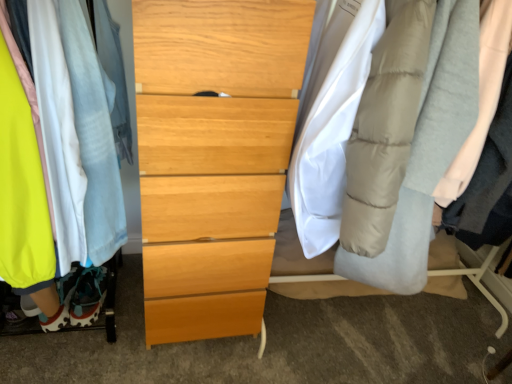
Measure the distance between point (240, 69) and camera.

The depth of point (240, 69) is 1.01 meters.

What is the approximate width of matte fabric clothes at left?

It is 26.02 inches.

Image resolution: width=512 pixels, height=384 pixels. What are the coordinates of `matte blue sneaker at lower left` in the screenshot? It's located at [88, 296].

Would you say light blue cotton robe at left, which is counted as the 1th robe, starting from the left, is outside matte blue sneaker at lower left?

Yes, light blue cotton robe at left, which is counted as the 1th robe, starting from the left, is outside of matte blue sneaker at lower left.

From a real-world perspective, is light blue cotton robe at left, the 2th robe positioned from the right, physically below matte blue sneaker at lower left?

No, from a real-world perspective, light blue cotton robe at left, the 2th robe positioned from the right, is not below matte blue sneaker at lower left.

Can you see light blue cotton robe at left, the 2th robe positioned from the right, touching matte blue sneaker at lower left?

light blue cotton robe at left, the 2th robe positioned from the right, is not next to matte blue sneaker at lower left, and they're not touching.

Image resolution: width=512 pixels, height=384 pixels. What are the coordinates of `the 1st robe positioned above the matte blue sneaker at lower left (from a real-world perspective)` in the screenshot? It's located at tap(92, 139).

You are a GUI agent. You are given a task and a screenshot of the screen. Output one action in this format:
    pyautogui.click(x=<x>, y=<y>)
    Task: Click on the chest of drawers on the right of matte fabric clothes at left
    The width and height of the screenshot is (512, 384).
    Given the screenshot: What is the action you would take?
    pyautogui.click(x=213, y=157)

Can you confirm if matte fabric clothes at left is shorter than light wood chest of drawers at center?

Yes, matte fabric clothes at left is shorter than light wood chest of drawers at center.

From the image's perspective, which one is positioned lower, matte fabric clothes at left or light wood chest of drawers at center?

light wood chest of drawers at center, from the image's perspective.

From the picture: Which point is more forward, (96, 256) or (202, 40)?

Positioned in front is point (202, 40).

Can you tell me how much matte fabric clothes at left and matte blue sneaker at lower left differ in facing direction?

0.616 degrees.

Considering the points (61, 214) and (106, 290), which point is in front, point (61, 214) or point (106, 290)?

The point (61, 214) is more forward.

Is matte fabric clothes at left taller than matte blue sneaker at lower left?

Yes, matte fabric clothes at left is taller than matte blue sneaker at lower left.

Is matte fabric clothes at left positioned with its back to matte blue sneaker at lower left?

No, matte fabric clothes at left is not facing the opposite direction of matte blue sneaker at lower left.

In the image, is light wood chest of drawers at center on the left side or the right side of light gray quilted robe at right, which appears as the 2th robe when viewed from the left?

From the image, it's evident that light wood chest of drawers at center is to the left of light gray quilted robe at right, which appears as the 2th robe when viewed from the left.

Find the location of a particular element. Image resolution: width=512 pixels, height=384 pixels. chest of drawers behind the light gray quilted robe at right, which appears as the 2th robe when viewed from the left is located at coordinates (213, 157).

Looking at this image, how many degrees apart are the facing directions of light wood chest of drawers at center and light gray quilted robe at right, which appears as the 2th robe when viewed from the left?

The facing directions of light wood chest of drawers at center and light gray quilted robe at right, which appears as the 2th robe when viewed from the left, are 0.0574 degrees apart.

Considering the sizes of objects light wood chest of drawers at center and light gray quilted robe at right, which appears as the 2th robe when viewed from the left, in the image provided, who is thinner, light wood chest of drawers at center or light gray quilted robe at right, which appears as the 2th robe when viewed from the left,?

Thinner between the two is light gray quilted robe at right, which appears as the 2th robe when viewed from the left.

Which object is positioned more to the right, matte blue sneaker at lower left or light gray quilted robe at right, the first robe in the right-to-left sequence?

light gray quilted robe at right, the first robe in the right-to-left sequence.

Is matte blue sneaker at lower left further to camera compared to light gray quilted robe at right, which appears as the 2th robe when viewed from the left?

Yes.

How much distance is there between matte blue sneaker at lower left and light gray quilted robe at right, which appears as the 2th robe when viewed from the left?

matte blue sneaker at lower left and light gray quilted robe at right, which appears as the 2th robe when viewed from the left, are 1.25 meters apart.

From their relative heights in the image, would you say matte blue sneaker at lower left is taller or shorter than light gray quilted robe at right, which appears as the 2th robe when viewed from the left?

Clearly, matte blue sneaker at lower left is shorter compared to light gray quilted robe at right, which appears as the 2th robe when viewed from the left.

Is matte blue sneaker at lower left to the left of light blue cotton robe at left, the 2th robe positioned from the right, from the viewer's perspective?

Correct, you'll find matte blue sneaker at lower left to the left of light blue cotton robe at left, the 2th robe positioned from the right.

In the scene shown: Would you say matte blue sneaker at lower left contains light blue cotton robe at left, the 2th robe positioned from the right?

That's incorrect, light blue cotton robe at left, the 2th robe positioned from the right, is not inside matte blue sneaker at lower left.

Where is `shoe that is under the light blue cotton robe at left, the 2th robe positioned from the right (from a real-world perspective)`? This screenshot has height=384, width=512. shoe that is under the light blue cotton robe at left, the 2th robe positioned from the right (from a real-world perspective) is located at coordinates (88, 296).

Is matte blue sneaker at lower left further to camera compared to light blue cotton robe at left, the 2th robe positioned from the right?

Yes, matte blue sneaker at lower left is further from the camera.

Is matte blue sneaker at lower left next to matte fabric clothes at left?

matte blue sneaker at lower left and matte fabric clothes at left are not in contact.

Can you confirm if matte blue sneaker at lower left is smaller than matte fabric clothes at left?

Correct, matte blue sneaker at lower left occupies less space than matte fabric clothes at left.

How distant is matte blue sneaker at lower left from matte fabric clothes at left?

matte blue sneaker at lower left is 54.61 centimeters away from matte fabric clothes at left.

From a real-world perspective, is matte blue sneaker at lower left under matte fabric clothes at left?

Yes.

I want to click on shoe below the light blue cotton robe at left, the 2th robe positioned from the right (from a real-world perspective), so click(x=88, y=296).

This screenshot has width=512, height=384. In order to click on closet above the light wood chest of drawers at center (from the image's perspective) in this screenshot , I will do `click(77, 134)`.

When comparing their distances from matte fabric clothes at left, does light gray quilted robe at right, which appears as the 2th robe when viewed from the left, or light blue cotton robe at left, the 2th robe positioned from the right, seem closer?

light blue cotton robe at left, the 2th robe positioned from the right, is closer to matte fabric clothes at left.

Estimate the real-world distances between objects in this image. Which object is closer to light blue cotton robe at left, which is counted as the 1th robe, starting from the left, matte blue sneaker at lower left or light wood chest of drawers at center?

light wood chest of drawers at center is closer to light blue cotton robe at left, which is counted as the 1th robe, starting from the left.

Consider the image. Based on their spatial positions, is light blue cotton robe at left, the 2th robe positioned from the right, or light wood chest of drawers at center further from matte blue sneaker at lower left?

The object further to matte blue sneaker at lower left is light wood chest of drawers at center.

When comparing their distances from matte fabric clothes at left, does light wood chest of drawers at center or light gray quilted robe at right, the first robe in the right-to-left sequence, seem closer?

light wood chest of drawers at center is closer to matte fabric clothes at left.

Looking at the image, which one is located further to matte fabric clothes at left, light gray quilted robe at right, which appears as the 2th robe when viewed from the left, or light wood chest of drawers at center?

Based on the image, light gray quilted robe at right, which appears as the 2th robe when viewed from the left, appears to be further to matte fabric clothes at left.

Looking at the image, which one is located closer to matte blue sneaker at lower left, light blue cotton robe at left, which is counted as the 1th robe, starting from the left, or matte fabric clothes at left?

Based on the image, light blue cotton robe at left, which is counted as the 1th robe, starting from the left, appears to be nearer to matte blue sneaker at lower left.

When comparing their distances from light blue cotton robe at left, the 2th robe positioned from the right, does light wood chest of drawers at center or matte blue sneaker at lower left seem closer?

Among the two, light wood chest of drawers at center is located nearer to light blue cotton robe at left, the 2th robe positioned from the right.

Estimate the real-world distances between objects in this image. Which object is closer to matte fabric clothes at left, light wood chest of drawers at center or matte blue sneaker at lower left?

light wood chest of drawers at center lies closer to matte fabric clothes at left than the other object.

Image resolution: width=512 pixels, height=384 pixels. I want to click on the chest of drawers situated between matte blue sneaker at lower left and light gray quilted robe at right, which appears as the 2th robe when viewed from the left, from left to right, so click(213, 157).

The height and width of the screenshot is (384, 512). In order to click on chest of drawers between light blue cotton robe at left, the 2th robe positioned from the right, and light gray quilted robe at right, which appears as the 2th robe when viewed from the left, in the horizontal direction in this screenshot , I will do `click(213, 157)`.

In order to click on robe between matte blue sneaker at lower left and light gray quilted robe at right, the first robe in the right-to-left sequence in this screenshot , I will do `click(92, 139)`.

Identify the location of robe located between matte fabric clothes at left and light gray quilted robe at right, the first robe in the right-to-left sequence, in the left-right direction. (92, 139).